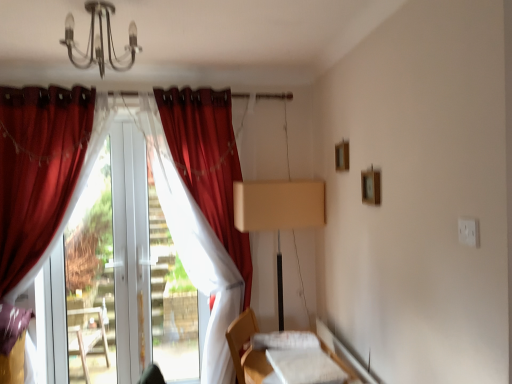
Question: Does velvet red curtain at left, which appears as the first curtain when viewed from the right, have a greater height compared to white fabric bed at lower center?

Choices:
 (A) yes
 (B) no

Answer: (A)

Question: Can you confirm if velvet red curtain at left, the third curtain from the left, is bigger than white fabric bed at lower center?

Choices:
 (A) no
 (B) yes

Answer: (B)

Question: From a real-world perspective, is velvet red curtain at left, the third curtain from the left, located higher than white fabric bed at lower center?

Choices:
 (A) no
 (B) yes

Answer: (B)

Question: From the image's perspective, is velvet red curtain at left, the third curtain from the left, below white fabric bed at lower center?

Choices:
 (A) yes
 (B) no

Answer: (B)

Question: Is velvet red curtain at left, which appears as the first curtain when viewed from the right, oriented towards white fabric bed at lower center?

Choices:
 (A) yes
 (B) no

Answer: (A)

Question: Based on their sizes in the image, would you say transparent plastic window screen at center is bigger or smaller than matte red curtain at left, which ranks as the 3th curtain in right-to-left order?

Choices:
 (A) big
 (B) small

Answer: (B)

Question: Is transparent plastic window screen at center to the left or to the right of matte red curtain at left, which ranks as the 3th curtain in right-to-left order, in the image?

Choices:
 (A) right
 (B) left

Answer: (A)

Question: Considering the positions of point (166, 329) and point (17, 218), is point (166, 329) closer or farther from the camera than point (17, 218)?

Choices:
 (A) farther
 (B) closer

Answer: (A)

Question: From a real-world perspective, is transparent plastic window screen at center above or below matte red curtain at left, which ranks as the 3th curtain in right-to-left order?

Choices:
 (A) below
 (B) above

Answer: (A)

Question: Considering the positions of point (93, 44) and point (245, 326), is point (93, 44) closer or farther from the camera than point (245, 326)?

Choices:
 (A) closer
 (B) farther

Answer: (A)

Question: Do you think metallic chandelier at upper center is within white fabric bed at lower center, or outside of it?

Choices:
 (A) inside
 (B) outside

Answer: (B)

Question: Is metallic chandelier at upper center in front of or behind white fabric bed at lower center in the image?

Choices:
 (A) front
 (B) behind

Answer: (A)

Question: From a real-world perspective, is metallic chandelier at upper center above or below white fabric bed at lower center?

Choices:
 (A) below
 (B) above

Answer: (B)

Question: Which is correct: white fabric at lower right is inside matte red curtain at left, which ranks as the 3th curtain in right-to-left order, or outside of it?

Choices:
 (A) inside
 (B) outside

Answer: (B)

Question: Is point (297, 367) closer or farther from the camera than point (72, 203)?

Choices:
 (A) farther
 (B) closer

Answer: (B)